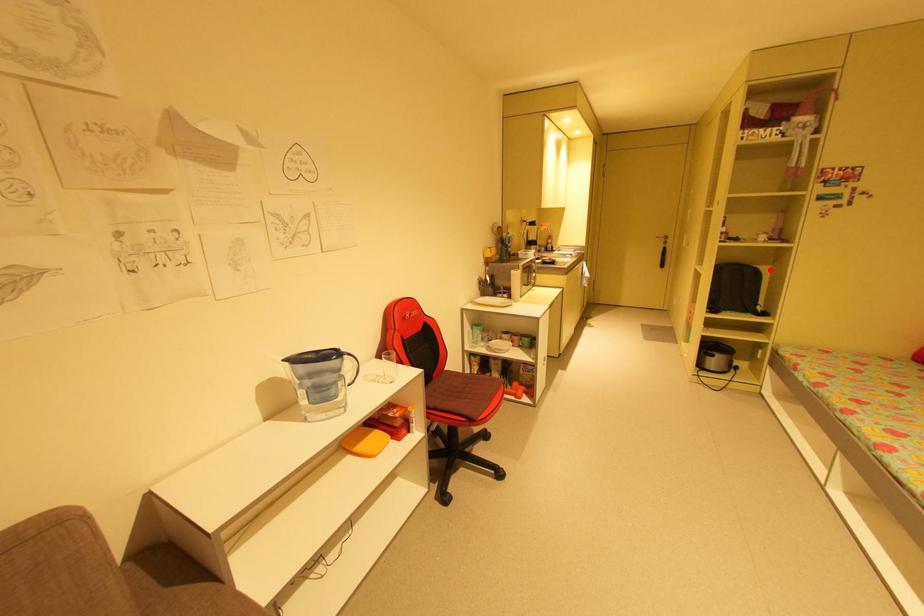
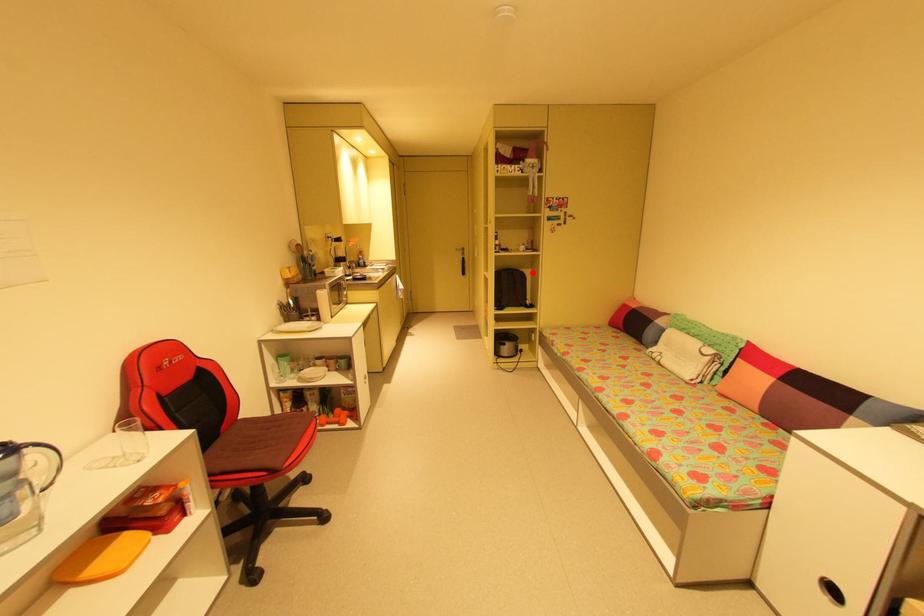
I am providing you with two images of the same scene from different viewpoints. A red point is marked on the first image and another point is marked on the second image. Is the red point in image1 aligned with the point shown in image2?

Yes